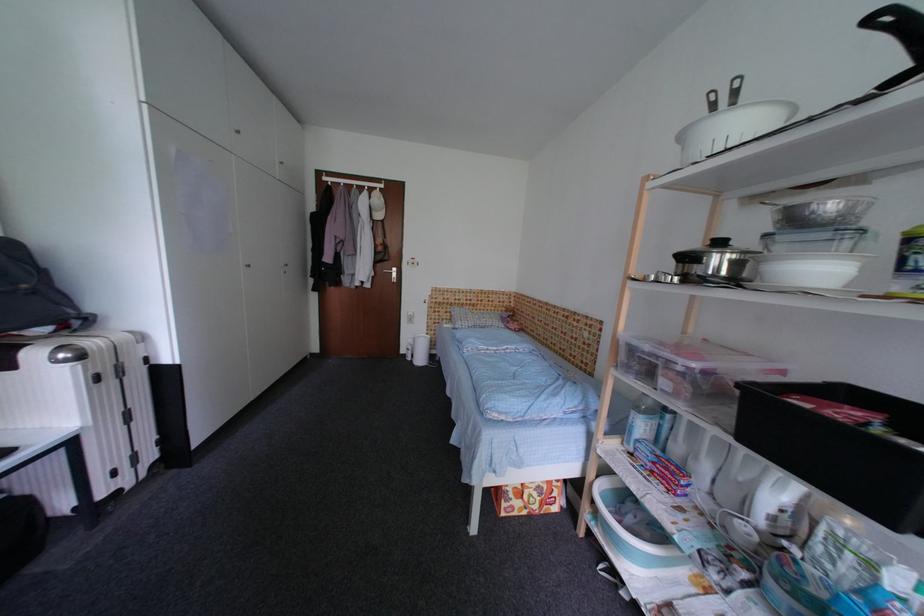
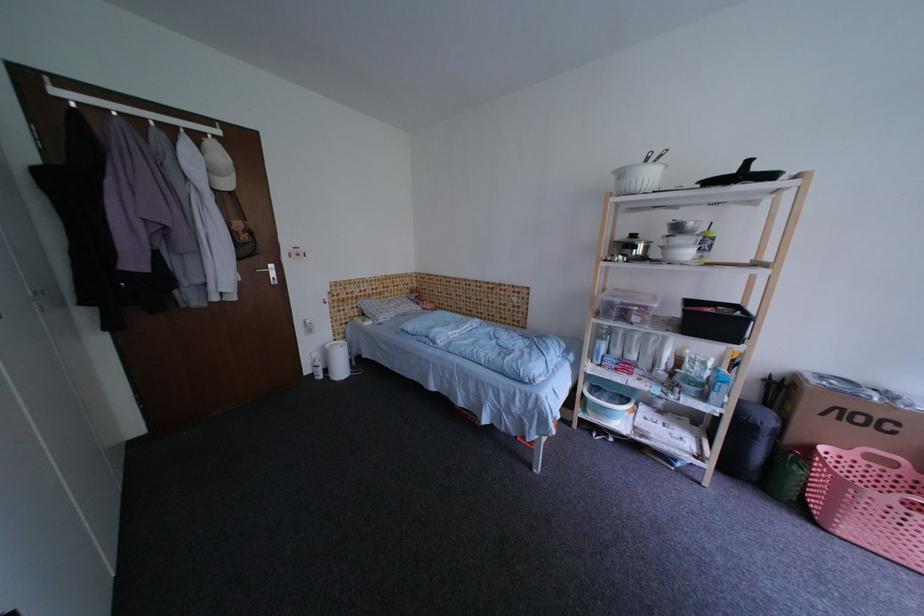
In the second image, find the point that corresponds to (x=410, y=353) in the first image.

(314, 374)